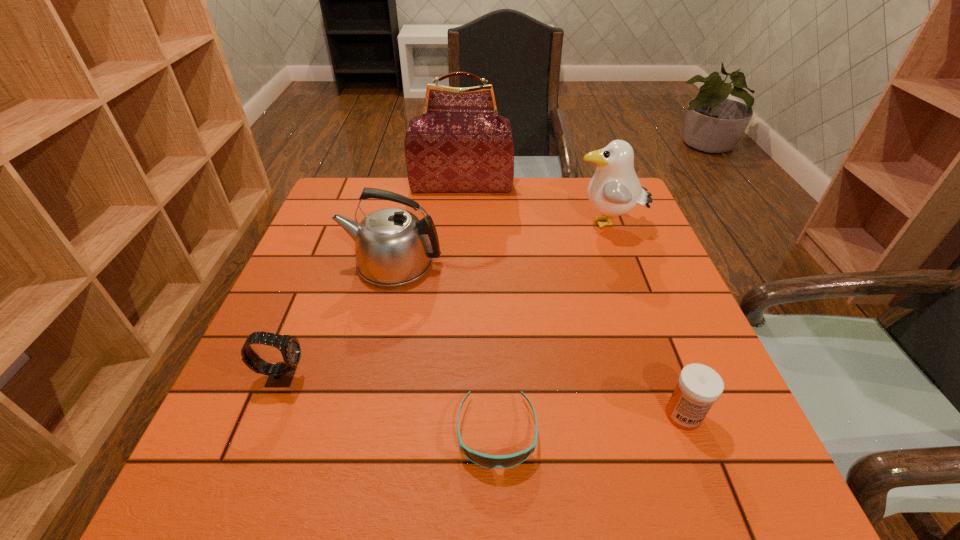
You are a GUI agent. You are given a task and a screenshot of the screen. Output one action in this format:
    pyautogui.click(x=<x>, y=<y>)
    Task: Click on the gull present at the right edge
    This screenshot has height=540, width=960.
    Given the screenshot: What is the action you would take?
    pyautogui.click(x=614, y=190)

Where is `medicine located in the right edge section of the desktop`? The height and width of the screenshot is (540, 960). medicine located in the right edge section of the desktop is located at coordinates (699, 386).

Locate an element on the screen. object that is at the far right corner is located at coordinates coord(614,190).

Where is `vacant space at the far edge of the desktop`? vacant space at the far edge of the desktop is located at coordinates (551, 180).

This screenshot has width=960, height=540. In the image, there is a desktop. What are the coordinates of `vacant space at the near edge` in the screenshot? It's located at (384, 482).

In order to click on free space at the left edge in this screenshot , I will do `click(309, 242)`.

Locate an element on the screen. The image size is (960, 540). vacant space at the right edge of the desktop is located at coordinates (643, 298).

In the image, there is a desktop. Where is `free space at the far left corner`? The width and height of the screenshot is (960, 540). free space at the far left corner is located at coordinates point(359,178).

Where is `vacant space at the far right corner of the desktop`? vacant space at the far right corner of the desktop is located at coordinates (585, 181).

The image size is (960, 540). What are the coordinates of `vacant space that's between the gull and the shortest object` in the screenshot? It's located at (552, 328).